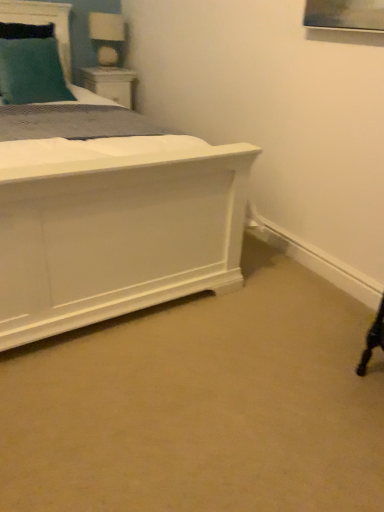
Question: Considering the positions of teal fabric headboard at upper left and white wood nightstand at upper left in the image, is teal fabric headboard at upper left taller or shorter than white wood nightstand at upper left?

Choices:
 (A) tall
 (B) short

Answer: (A)

Question: From the image's perspective, is teal fabric headboard at upper left positioned above or below white wood nightstand at upper left?

Choices:
 (A) below
 (B) above

Answer: (B)

Question: Estimate the real-world distances between objects in this image. Which object is closer to the teal fabric pillow at upper left?

Choices:
 (A) white glossy table lamp at upper left
 (B) white wood nightstand at upper left
 (C) teal fabric headboard at upper left

Answer: (C)

Question: Estimate the real-world distances between objects in this image. Which object is closer to the teal fabric pillow at upper left?

Choices:
 (A) teal fabric headboard at upper left
 (B) white glossy table lamp at upper left
 (C) white wood nightstand at upper left

Answer: (A)